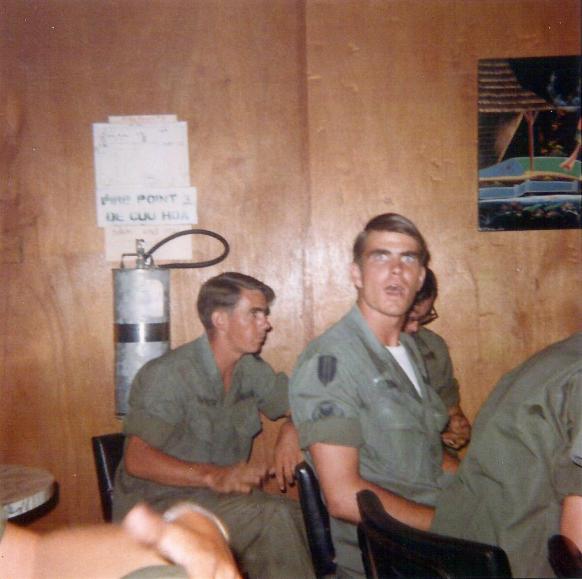
Find the location of `round table`. round table is located at coordinates 7,481.